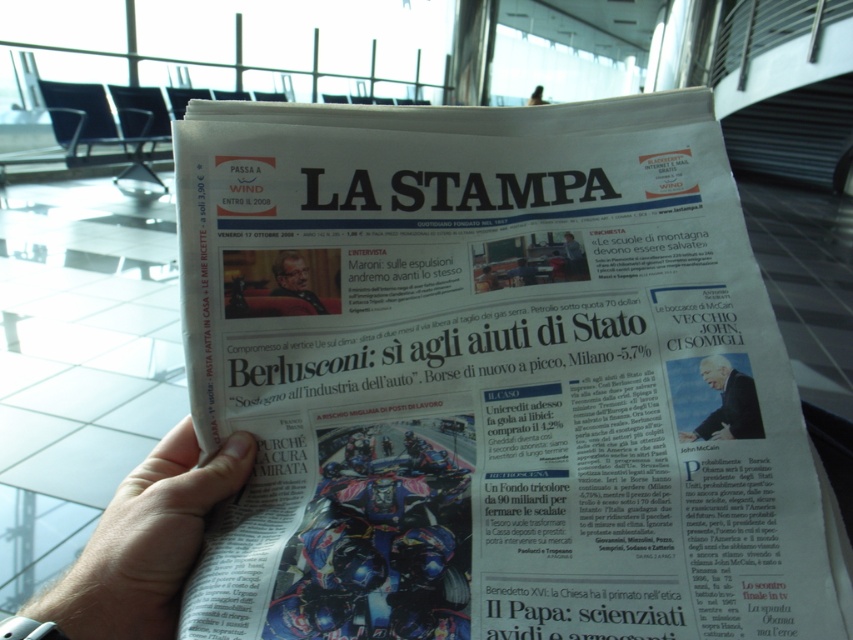
Question: In this image, where is white glossy newspaper at center located relative to smooth skin portrait at center?

Choices:
 (A) above
 (B) below

Answer: (B)

Question: Which point appears closest to the camera in this image?

Choices:
 (A) [61, 588]
 (B) [659, 257]

Answer: (A)

Question: Which point is closer to the camera taking this photo?

Choices:
 (A) (231, 628)
 (B) (137, 616)
 (C) (762, 435)
 (D) (289, 269)

Answer: (A)

Question: Observing the image, what is the correct spatial positioning of white glossy newspaper at center in reference to dark suit jacket at upper right?

Choices:
 (A) left
 (B) right

Answer: (A)

Question: Is white glossy newspaper at center smaller than skinny white hand at lower left?

Choices:
 (A) yes
 (B) no

Answer: (B)

Question: Which object appears farthest from the camera in this image?

Choices:
 (A) dark suit jacket at upper right
 (B) white glossy newspaper at center
 (C) smooth skin portrait at center

Answer: (C)